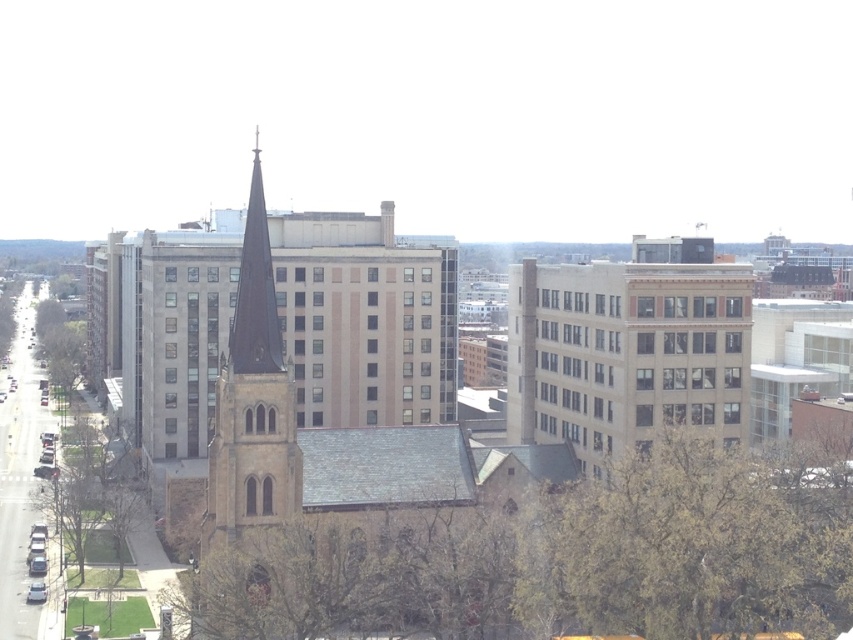
From the picture: Does brown stone church at center appear under green leafy tree at lower left?

No, brown stone church at center is not below green leafy tree at lower left.

Between brown stone church at center and green leafy tree at lower left, which one is positioned higher?

brown stone church at center

Find the location of a particular element. This screenshot has width=853, height=640. brown stone church at center is located at coordinates (519, 476).

Where is `brown stone church at center`? The height and width of the screenshot is (640, 853). brown stone church at center is located at coordinates (519, 476).

Can you confirm if brown stone church at center is thinner than green leafy tree at left?

In fact, brown stone church at center might be wider than green leafy tree at left.

Locate an element on the screen. This screenshot has height=640, width=853. brown stone church at center is located at coordinates (519, 476).

Is green leafy tree at lower left bigger than green leafy tree at left?

Correct, green leafy tree at lower left is larger in size than green leafy tree at left.

Is point (384, 609) more distant than point (68, 296)?

No, (384, 609) is closer to viewer.

What do you see at coordinates (532, 545) in the screenshot? Image resolution: width=853 pixels, height=640 pixels. I see `green leafy tree at lower left` at bounding box center [532, 545].

Where is `green leafy tree at lower left`? This screenshot has width=853, height=640. green leafy tree at lower left is located at coordinates (532, 545).